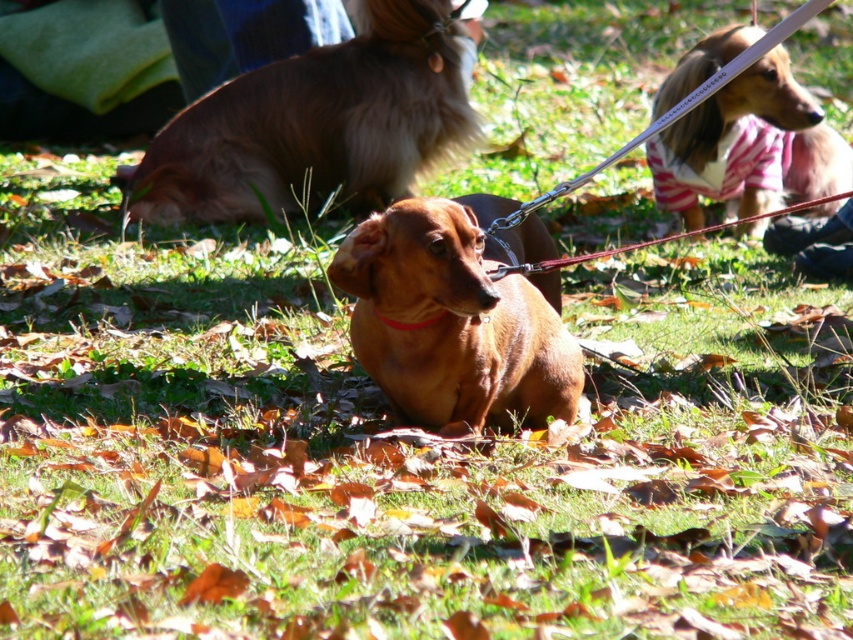
Question: Where is brown shiny dog at center located in relation to brown leather collar at center in the image?

Choices:
 (A) above
 (B) below

Answer: (A)

Question: Which is farther from the brown fluffy dog at upper center?

Choices:
 (A) brown shiny dog at center
 (B) brown fur dog at center
 (C) brown leather collar at center

Answer: (C)

Question: Can you confirm if brown fur dog at center is bigger than brown leather collar at center?

Choices:
 (A) no
 (B) yes

Answer: (B)

Question: Which point is farther to the camera?

Choices:
 (A) (376, 314)
 (B) (347, 106)
 (C) (549, 396)
 (D) (785, 145)

Answer: (B)

Question: Which point is farther to the camera?

Choices:
 (A) brown leather collar at center
 (B) brown fluffy dog at upper center

Answer: (B)

Question: Does brown fur dog at center have a greater width compared to brown leather collar at center?

Choices:
 (A) yes
 (B) no

Answer: (A)